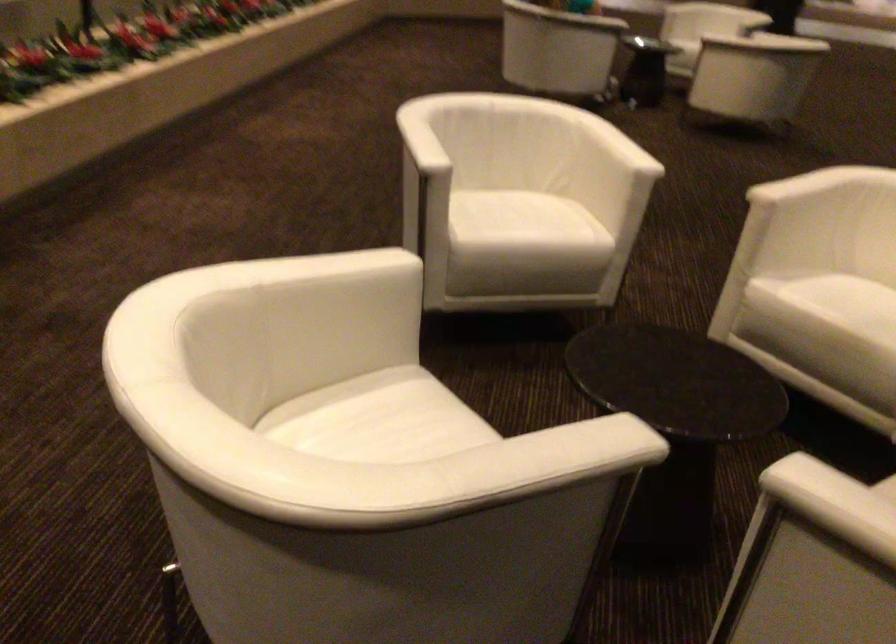
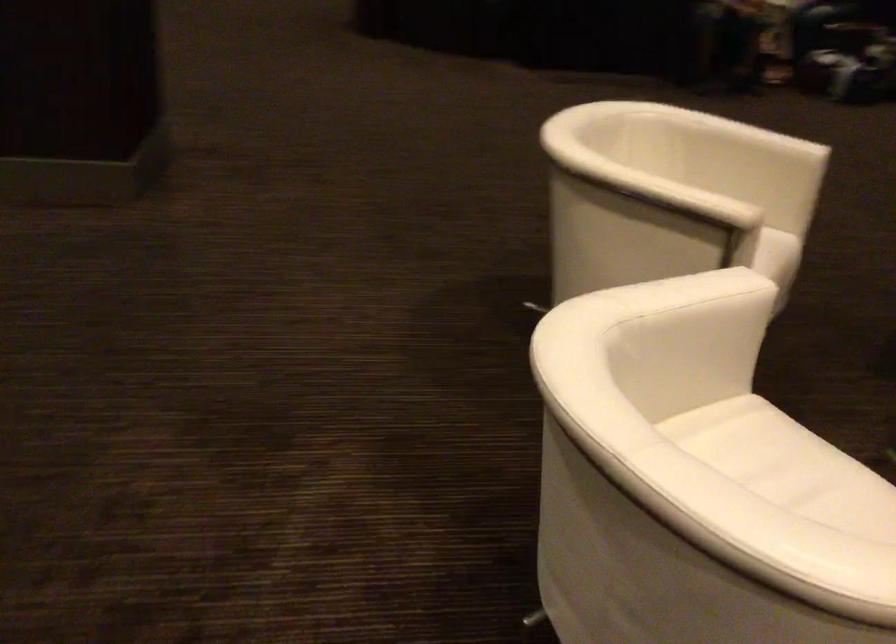
The point at (547, 212) is marked in the first image. Where is the corresponding point in the second image?

(767, 453)